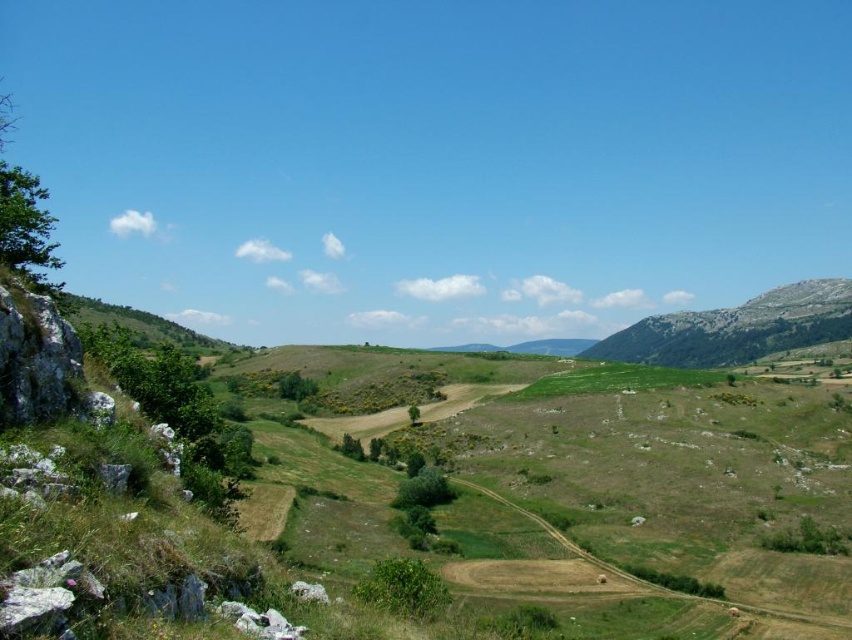
You are standing at the origin point in the image. Which direction should you move to reach the green grassy field at center?

The green grassy field at center is located at coordinates approximately 0.714 on the x axis and 0.126 on the y axis. Since you are at the origin, you should move towards the positive x and positive y directions to reach it.

You are standing in the rural landscape and want to determine the relative positions of two points marked in the image. Which point, point (579, 484) or point (723, 365), is closer to you?

Point (579, 484) is closer to the viewer than point (723, 365).